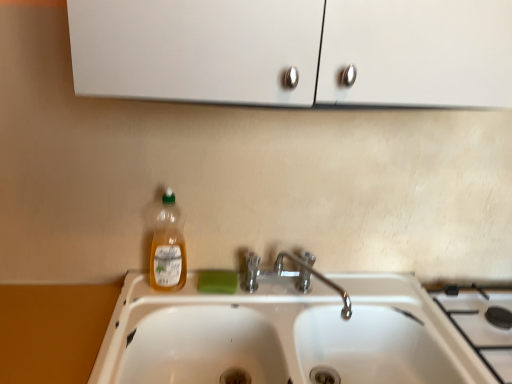
Where is `vacant area that lies to the right of green matte soap at sink`? This screenshot has height=384, width=512. vacant area that lies to the right of green matte soap at sink is located at coordinates (x=278, y=294).